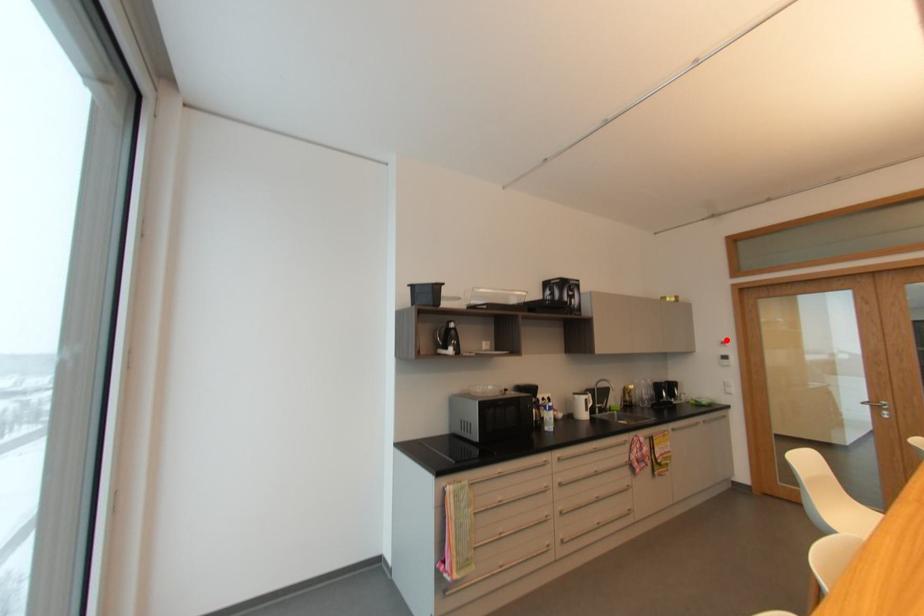
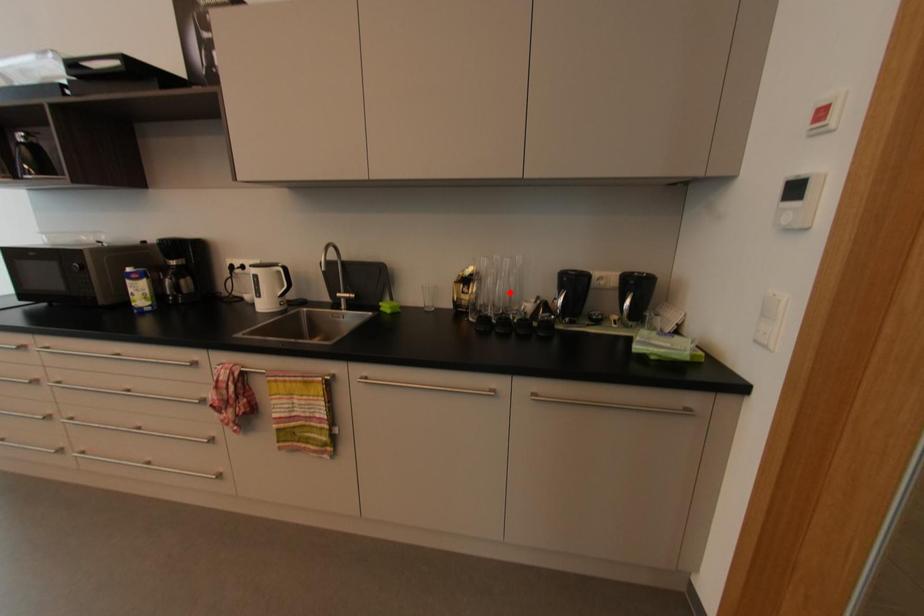
I am providing you with two images of the same scene from different viewpoints. A red point is marked on the first image and another point is marked on the second image. Are the points marked in image1 and image2 representing the same 3D position?

No